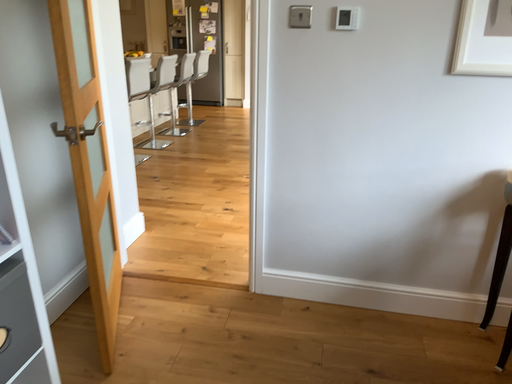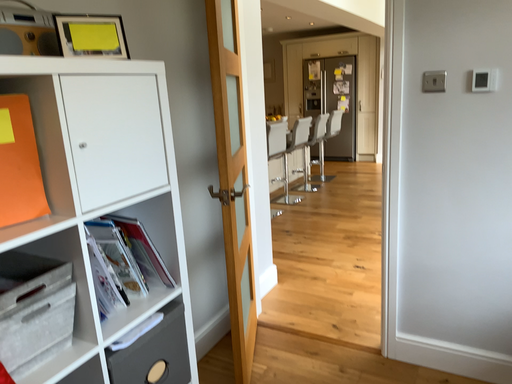
Question: How did the camera likely rotate when shooting the video?

Choices:
 (A) rotated downward
 (B) rotated upward

Answer: (B)